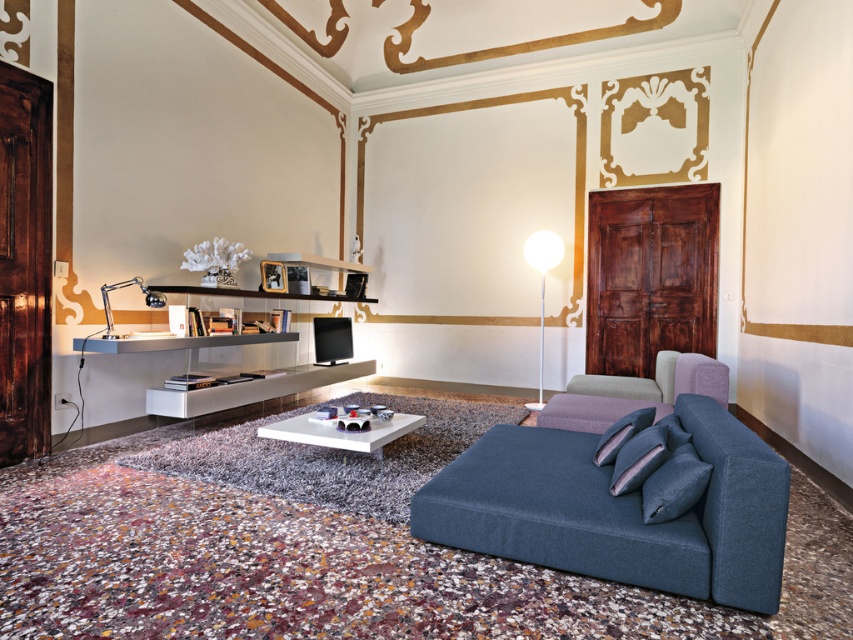
Can you confirm if white glossy coffee table at center is wider than chrome metallic desk lamp at left?

Indeed, white glossy coffee table at center has a greater width compared to chrome metallic desk lamp at left.

Which is more to the right, white glossy coffee table at center or chrome metallic desk lamp at left?

white glossy coffee table at center is more to the right.

This screenshot has height=640, width=853. I want to click on white glossy coffee table at center, so click(x=341, y=432).

At what (x,y) coordinates should I click in order to perform the action: click on white glossy coffee table at center. Please return your answer as a coordinate pair (x, y). The height and width of the screenshot is (640, 853). Looking at the image, I should click on (341, 432).

Can you confirm if velvet blue couch at lower right is wider than white glossy floor lamp at center?

Yes, velvet blue couch at lower right is wider than white glossy floor lamp at center.

Is point (538, 496) positioned before point (523, 253)?

Yes, it is.

Is point (456, 541) closer to camera compared to point (537, 406)?

Yes, it is in front of point (537, 406).

At what (x,y) coordinates should I click in order to perform the action: click on velvet blue couch at lower right. Please return your answer as a coordinate pair (x, y). Looking at the image, I should click on (618, 509).

Is white glossy coffee table at center above white glossy floor lamp at center?

No, white glossy coffee table at center is not above white glossy floor lamp at center.

Does white glossy coffee table at center lie in front of white glossy floor lamp at center?

Yes, it is in front of white glossy floor lamp at center.

Is point (399, 433) farther from viewer compared to point (554, 246)?

No, it is in front of (554, 246).

Identify the location of white glossy coffee table at center. This screenshot has width=853, height=640. (341, 432).